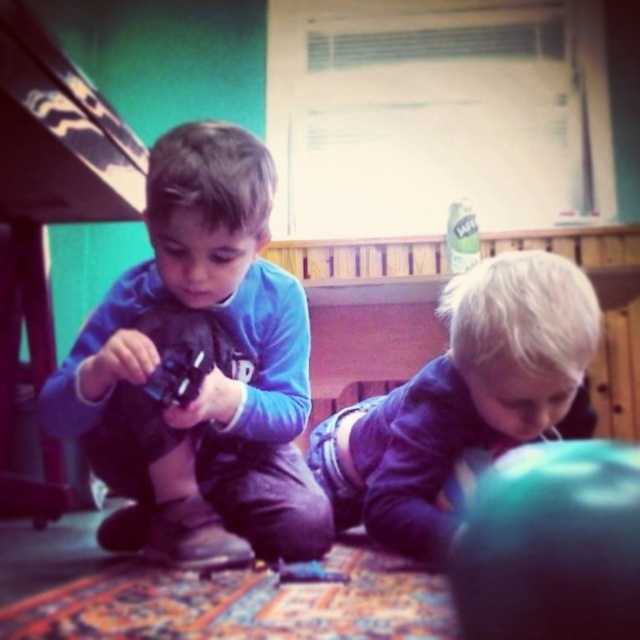
Which is below, matte blue shirt at center or purple denim shorts at lower right?

purple denim shorts at lower right is below.

Who is more forward, (260,312) or (550,384)?

Point (550,384) is in front.

The width and height of the screenshot is (640, 640). Identify the location of matte blue shirt at center. (205, 352).